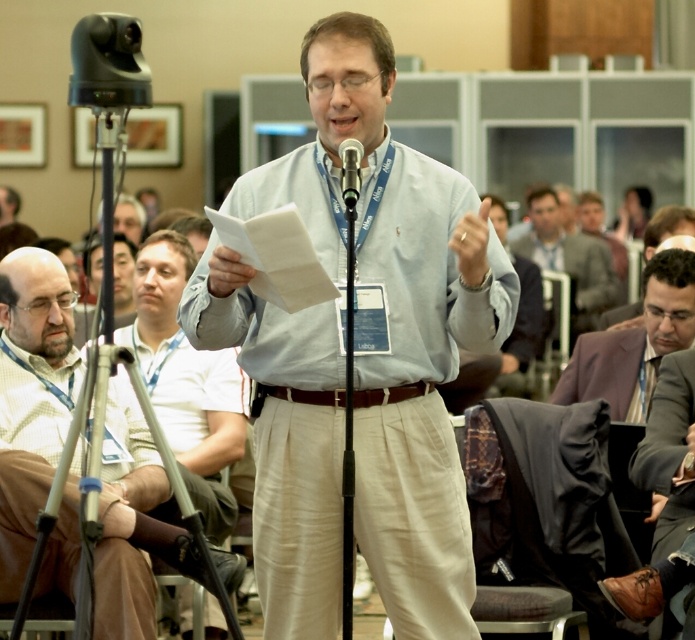
Who is lower down, light brown suit at center or gray fabric shirt at center?

gray fabric shirt at center

The image size is (695, 640). I want to click on light brown suit at center, so [x=569, y=257].

Find the location of `light brown suit at center`. light brown suit at center is located at coordinates (569, 257).

Which of these two, gray fabric shirt at center or black metallic microphone at center, stands taller?

gray fabric shirt at center is taller.

Can you confirm if gray fabric shirt at center is shorter than black metallic microphone at center?

No.

Find the location of `gray fabric shirt at center`. gray fabric shirt at center is located at coordinates (518, 298).

Measure the distance between point (278, 408) and camera.

They are 27.46 feet apart.

Is point (433, 368) farther from viewer compared to point (621, 292)?

No, it is in front of (621, 292).

The height and width of the screenshot is (640, 695). What do you see at coordinates (398, 317) in the screenshot?
I see `light blue shirt at center` at bounding box center [398, 317].

At what (x,y) coordinates should I click in order to perform the action: click on light blue shirt at center. Please return your answer as a coordinate pair (x, y). This screenshot has width=695, height=640. Looking at the image, I should click on (398, 317).